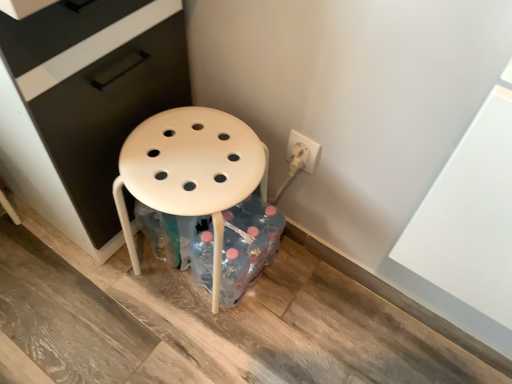
Question: Is white plastic outlet at right positioned in front of white plastic stool at center?

Choices:
 (A) no
 (B) yes

Answer: (A)

Question: Considering the relative positions of white plastic outlet at right and white plastic stool at center in the image provided, is white plastic outlet at right to the left of white plastic stool at center from the viewer's perspective?

Choices:
 (A) yes
 (B) no

Answer: (B)

Question: Can you confirm if white plastic outlet at right is bigger than white plastic stool at center?

Choices:
 (A) yes
 (B) no

Answer: (B)

Question: From a real-world perspective, is white plastic outlet at right located higher than white plastic stool at center?

Choices:
 (A) yes
 (B) no

Answer: (A)

Question: Does white plastic outlet at right have a lesser height compared to white plastic stool at center?

Choices:
 (A) yes
 (B) no

Answer: (A)

Question: Would you say white plastic stool at center is to the left or to the right of translucent plastic bottles at lower center in the picture?

Choices:
 (A) left
 (B) right

Answer: (A)

Question: Based on their sizes in the image, would you say white plastic stool at center is bigger or smaller than translucent plastic bottles at lower center?

Choices:
 (A) small
 (B) big

Answer: (B)

Question: Looking at their shapes, would you say white plastic stool at center is wider or thinner than translucent plastic bottles at lower center?

Choices:
 (A) wide
 (B) thin

Answer: (A)

Question: Do you think white plastic stool at center is within translucent plastic bottles at lower center, or outside of it?

Choices:
 (A) outside
 (B) inside

Answer: (A)

Question: Visually, is white plastic stool at center positioned to the left or to the right of white plastic outlet at right?

Choices:
 (A) right
 (B) left

Answer: (B)

Question: Considering the positions of white plastic stool at center and white plastic outlet at right in the image, is white plastic stool at center bigger or smaller than white plastic outlet at right?

Choices:
 (A) small
 (B) big

Answer: (B)

Question: Do you think white plastic stool at center is within white plastic outlet at right, or outside of it?

Choices:
 (A) inside
 (B) outside

Answer: (B)

Question: Does point (177, 142) appear closer or farther from the camera than point (292, 137)?

Choices:
 (A) farther
 (B) closer

Answer: (B)

Question: Is white plastic outlet at right taller or shorter than translucent plastic bottles at lower center?

Choices:
 (A) short
 (B) tall

Answer: (A)

Question: Relative to translucent plastic bottles at lower center, is white plastic outlet at right in front or behind?

Choices:
 (A) behind
 (B) front

Answer: (A)